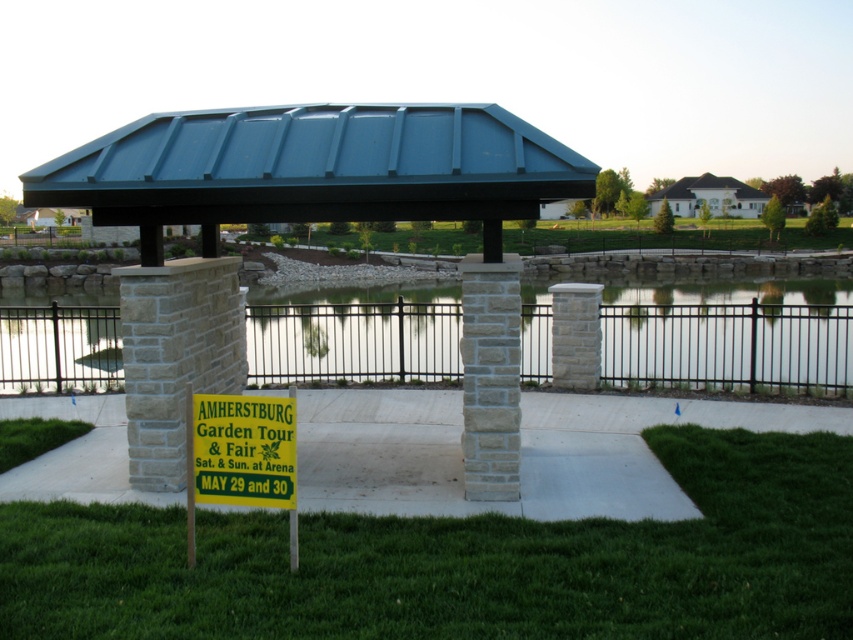
This screenshot has height=640, width=853. What do you see at coordinates (462, 561) in the screenshot?
I see `green grass at lower center` at bounding box center [462, 561].

Identify the location of green grass at lower center. (462, 561).

Who is more forward, (483,349) or (700,342)?

Point (483,349) is more forward.

Find the location of a particular element. This screenshot has width=853, height=640. metallic stone gazebo at center is located at coordinates (306, 220).

Where is `metallic stone gazebo at center`? The width and height of the screenshot is (853, 640). metallic stone gazebo at center is located at coordinates (306, 220).

Where is `green grass at lower center`? The width and height of the screenshot is (853, 640). green grass at lower center is located at coordinates click(x=462, y=561).

Who is more distant from viewer, (134, 570) or (784, 316)?

The point (784, 316) is behind.

The image size is (853, 640). In order to click on green grass at lower center in this screenshot , I will do `click(462, 561)`.